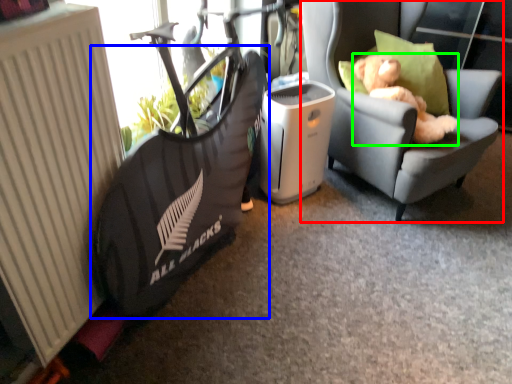
Question: Based on their relative distances, which object is farther from chair (highlighted by a red box)? Choose from bean bag chair (highlighted by a blue box) and animal (highlighted by a green box).

Choices:
 (A) bean bag chair
 (B) animal

Answer: (A)